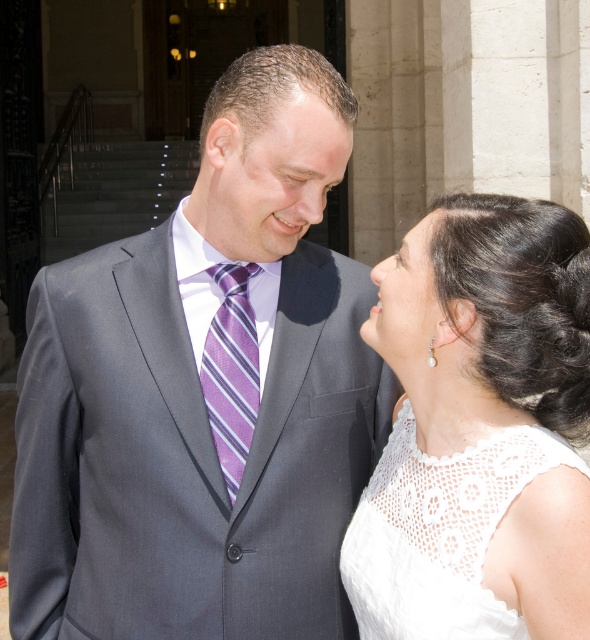
Question: Which object appears farthest from the camera in this image?

Choices:
 (A) matte gray suit at center
 (B) purple striped tie at center
 (C) white lace dress at center
 (D) matte gray forehead at upper center

Answer: (B)

Question: Does matte gray suit at center come in front of purple striped tie at center?

Choices:
 (A) no
 (B) yes

Answer: (B)

Question: Can you confirm if matte gray suit at center is bigger than matte gray forehead at upper center?

Choices:
 (A) yes
 (B) no

Answer: (A)

Question: Is white lace dress at center bigger than purple striped tie at center?

Choices:
 (A) yes
 (B) no

Answer: (A)

Question: Which point is closer to the camera?

Choices:
 (A) matte gray forehead at upper center
 (B) matte gray suit at center
 (C) purple striped tie at center
 (D) white lace dress at center

Answer: (D)

Question: Among these points, which one is farthest from the camera?

Choices:
 (A) (135, 513)
 (B) (273, 154)
 (C) (237, 483)

Answer: (A)